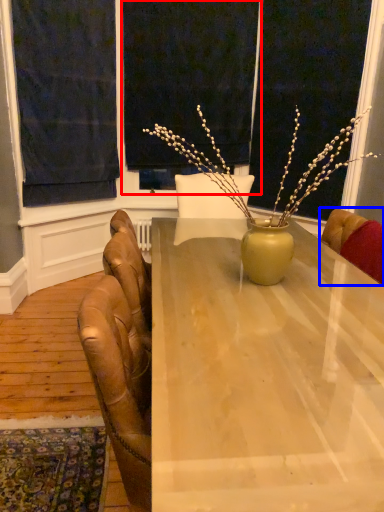
Question: Which object is further to the camera taking this photo, window screen (highlighted by a red box) or chair (highlighted by a blue box)?

Choices:
 (A) window screen
 (B) chair

Answer: (A)